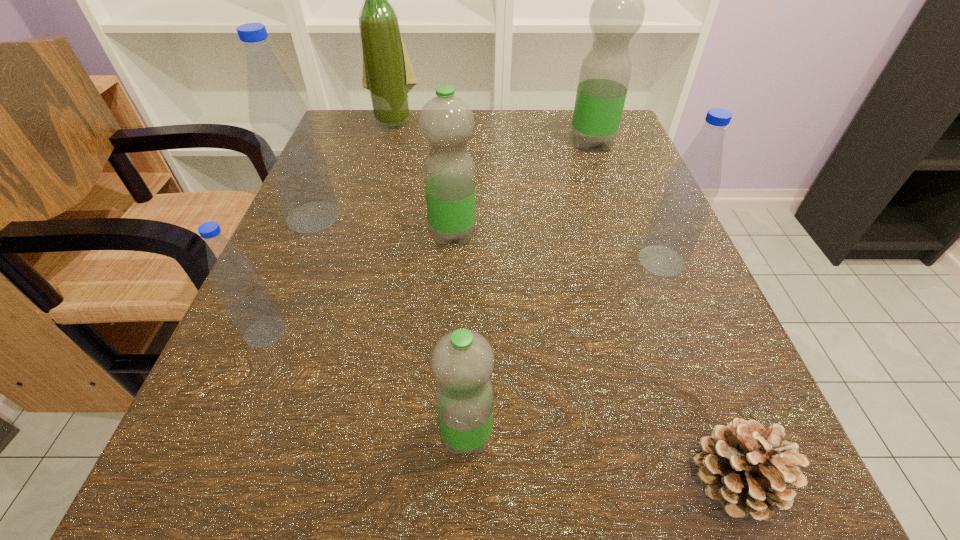
I want to click on blank space at the far edge of the desktop, so click(x=474, y=160).

The height and width of the screenshot is (540, 960). In order to click on vacant region at the near edge of the desktop in this screenshot , I will do `click(492, 530)`.

Locate an element on the screen. The height and width of the screenshot is (540, 960). free space at the left edge of the desktop is located at coordinates (344, 380).

Where is `free spot at the right edge of the desktop`? free spot at the right edge of the desktop is located at coordinates pos(694,418).

I want to click on vacant space at the far left corner of the desktop, so click(365, 152).

In order to click on vacant space at the far right corner of the desktop in this screenshot , I will do `click(621, 133)`.

I want to click on vacant space at the near right corner, so coord(796,537).

The width and height of the screenshot is (960, 540). Find the location of `free space between the second nearest green water bottle and the biggest green water bottle`. free space between the second nearest green water bottle and the biggest green water bottle is located at coordinates (522, 188).

You are a GUI agent. You are given a task and a screenshot of the screen. Output one action in this format:
    pyautogui.click(x=<x>, y=<y>)
    Task: Click on the free space between the wine bottle and the biggest blue water bottle
    
    Given the screenshot: What is the action you would take?
    pyautogui.click(x=353, y=169)

Locate an element on the screen. The width and height of the screenshot is (960, 540). free space that is in between the biggest green water bottle and the rightmost blue water bottle is located at coordinates (627, 202).